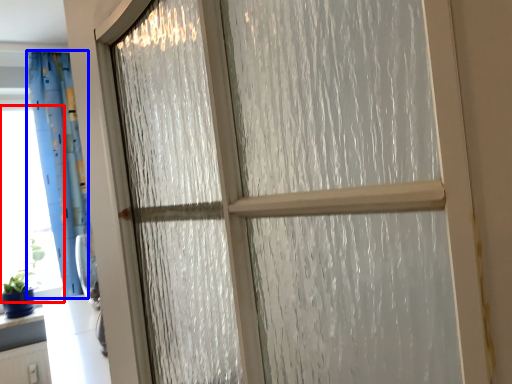
Question: Among these objects, which one is farthest to the camera, window screen (highlighted by a red box) or curtain (highlighted by a blue box)?

Choices:
 (A) window screen
 (B) curtain

Answer: (A)